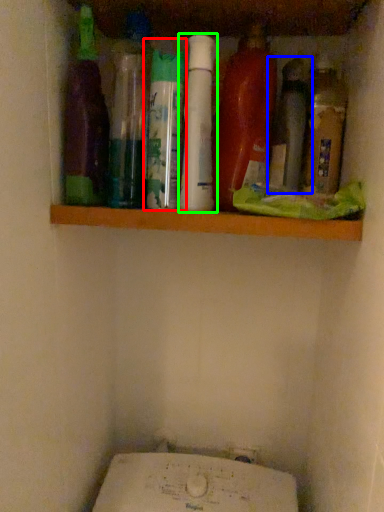
Question: Considering the real-world distances, which object is closest to bottle (highlighted by a red box)? bottle (highlighted by a blue box) or bottle (highlighted by a green box).

Choices:
 (A) bottle
 (B) bottle

Answer: (B)